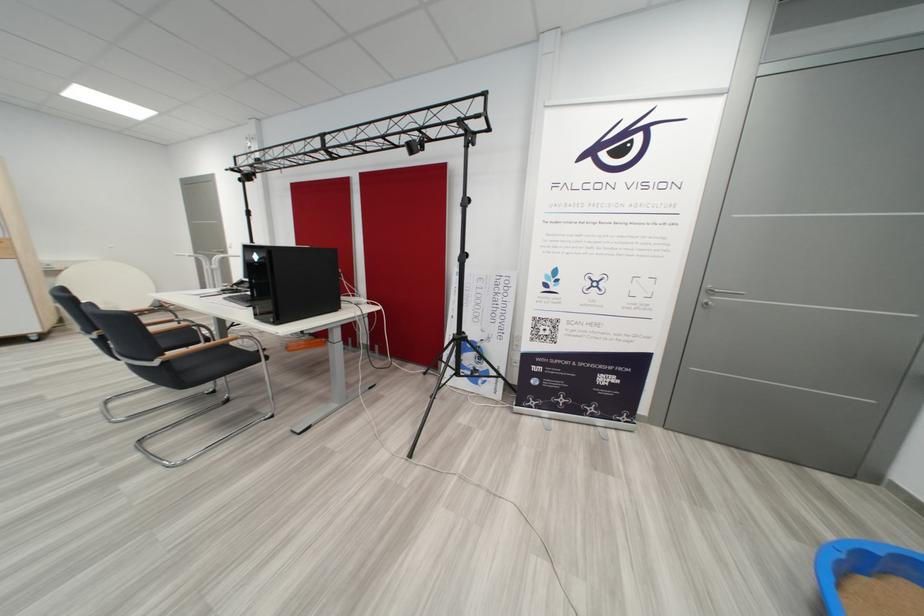
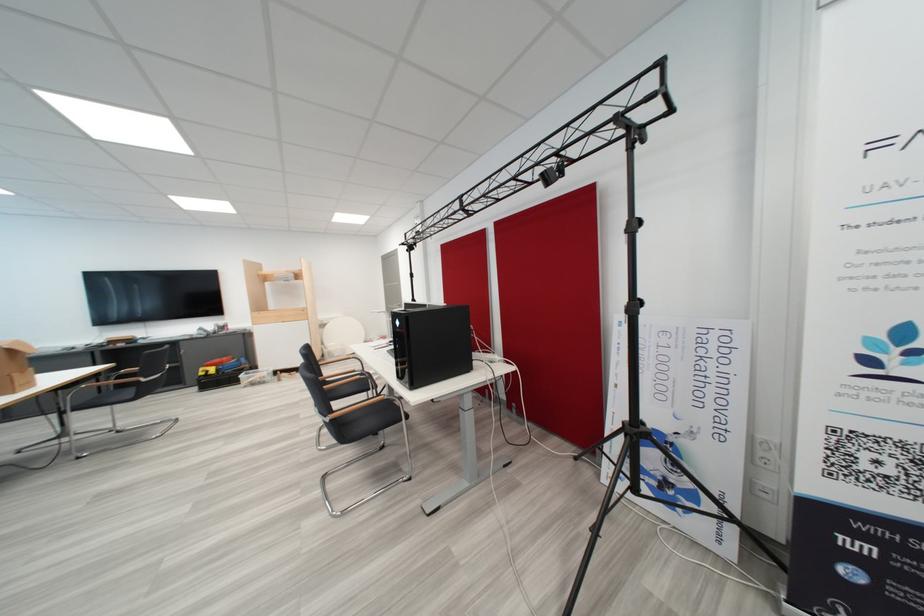
Where in the second image is the point corresponding to the point at 511,339 from the first image?

(731, 439)